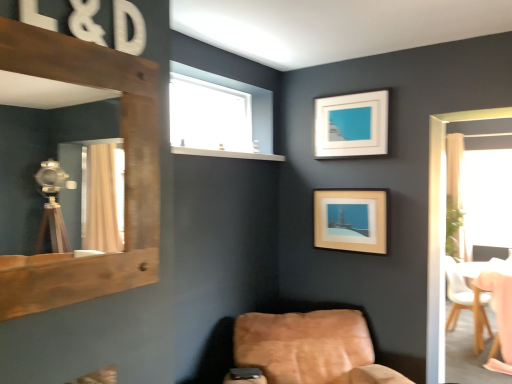
Identify the location of free space above transparent glass window at upper center (from a real-world perspective). Image resolution: width=512 pixels, height=384 pixels. (209, 87).